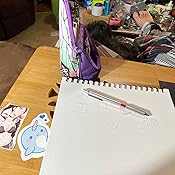
The height and width of the screenshot is (175, 175). I want to click on bottle, so click(x=96, y=11).